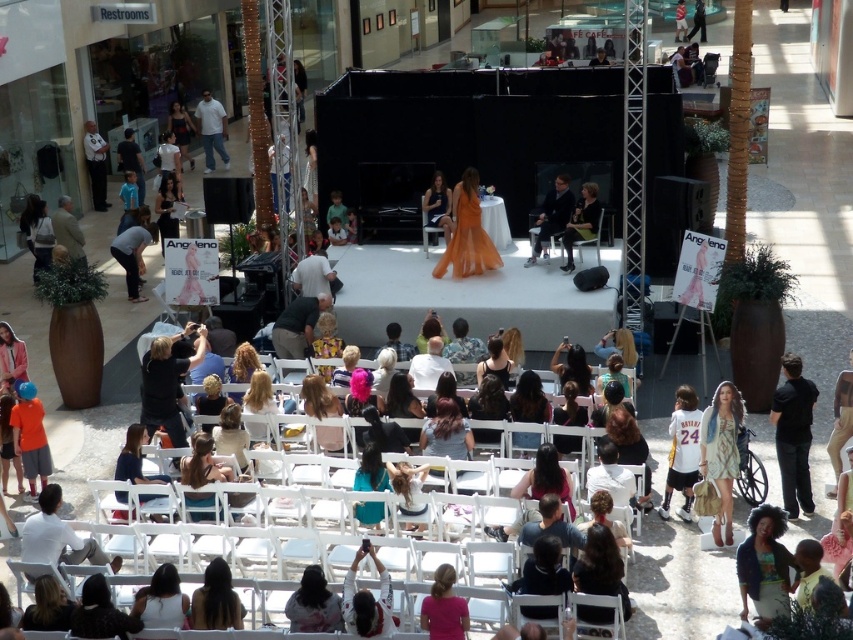
Question: In this image, where is orange cotton shirt at lower left located relative to matte black dress at center?

Choices:
 (A) above
 (B) below

Answer: (B)

Question: Which object is the farthest from the black cotton shirt at lower right?

Choices:
 (A) matte black jacket at lower right
 (B) pink fabric dress at lower center

Answer: (B)

Question: Is white jersey at center further to camera compared to matte black dress at center?

Choices:
 (A) yes
 (B) no

Answer: (B)

Question: Which object appears farthest from the camera in this image?

Choices:
 (A) matte black dress at center
 (B) white jersey at center
 (C) white fabric dress at center

Answer: (A)

Question: Is orange chiffon dress at center bigger than white jersey at center?

Choices:
 (A) yes
 (B) no

Answer: (A)

Question: Which object appears closest to the camera in this image?

Choices:
 (A) matte black dress at center
 (B) white fabric dress at center

Answer: (B)